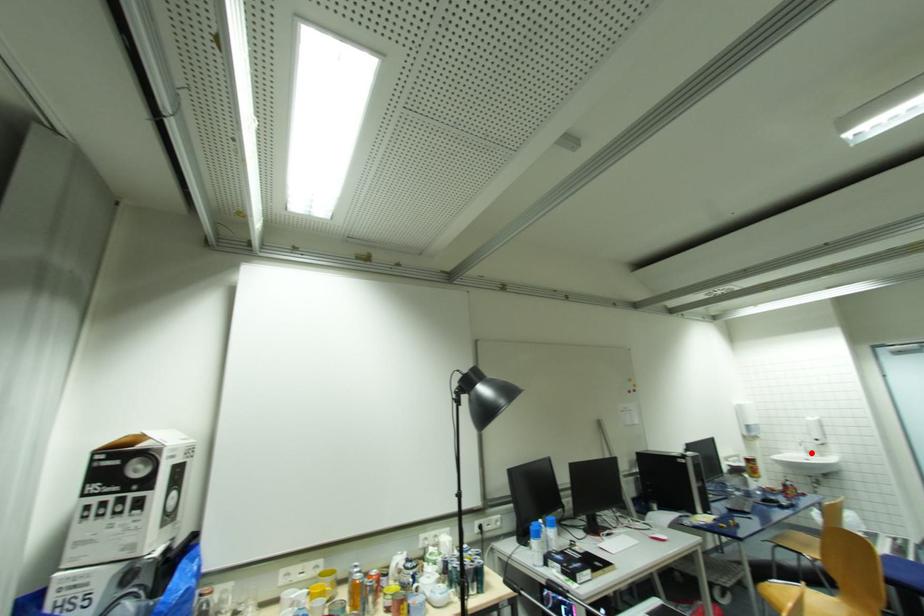
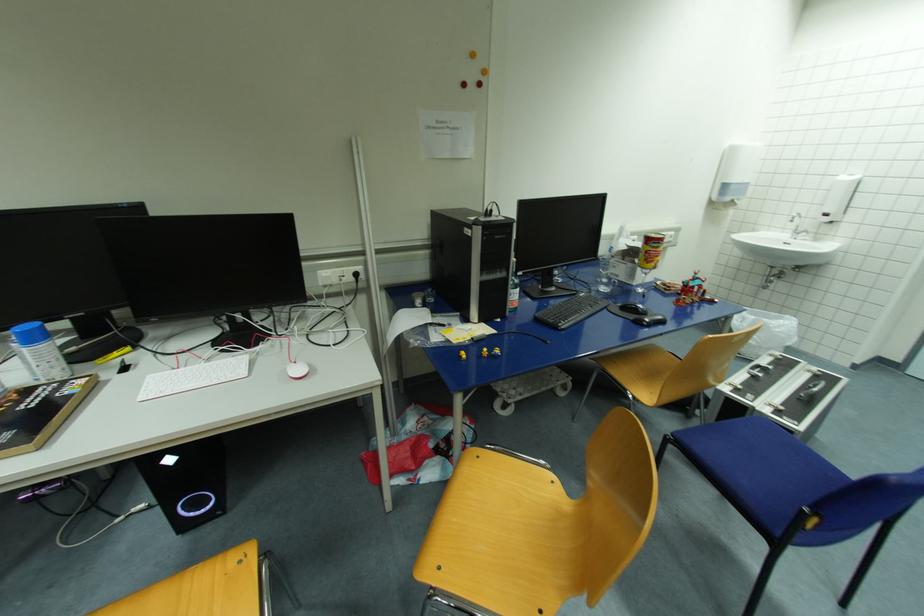
Locate, in the second image, the point that corresponds to the highlighted location in the first image.

(799, 233)